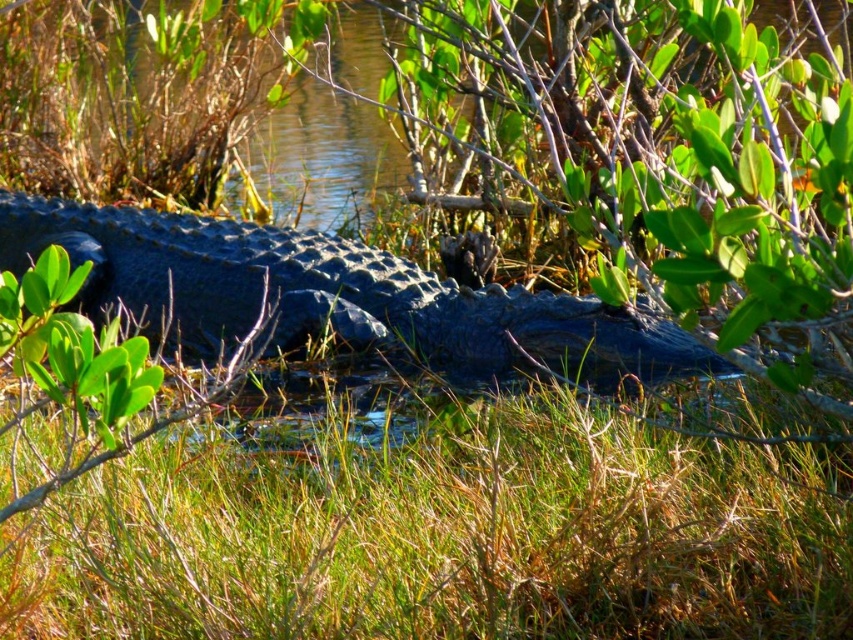
You are observing the alligator in the marsh. There are two points marked on the image at coordinates point (x=287, y=609) and point (x=463, y=364). Which point is nearer to you, the observer?

Point (x=287, y=609) is closer to the camera than point (x=463, y=364), so the point at (x=287, y=609) is nearer to you.

You are a small frog hiding in the green grass at lower center. You see the shiny dark blue crocodile at center nearby. Based on your position, can you see the crocodile above you?

The green grass at lower center is positioned under the shiny dark blue crocodile at center, so yes, the crocodile is above you and visible from your hiding spot.